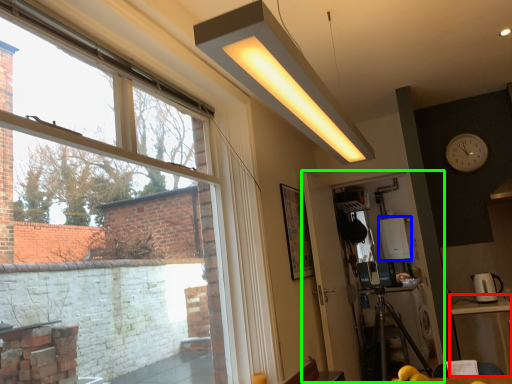
Question: Which is nearer to the table (highlighted by a red box)? appliance (highlighted by a blue box) or screen door (highlighted by a green box).

Choices:
 (A) appliance
 (B) screen door

Answer: (B)